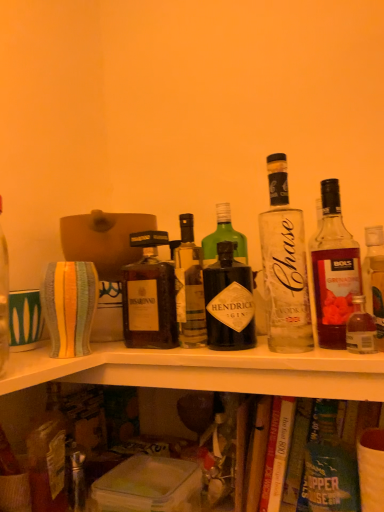
Question: Is translucent glass bottle at upper right, marked as the first bottle in a right-to-left arrangement, facing away from hardcover book at lower center?

Choices:
 (A) yes
 (B) no

Answer: (B)

Question: Does translucent glass bottle at upper right, the sixth bottle from the left, come behind hardcover book at lower center?

Choices:
 (A) yes
 (B) no

Answer: (B)

Question: Can you confirm if translucent glass bottle at upper right, the sixth bottle from the left, is wider than hardcover book at lower center?

Choices:
 (A) yes
 (B) no

Answer: (B)

Question: Would you say translucent glass bottle at upper right, the sixth bottle from the left, contains hardcover book at lower center?

Choices:
 (A) yes
 (B) no

Answer: (B)

Question: Does translucent glass bottle at upper right, marked as the first bottle in a right-to-left arrangement, appear on the left side of hardcover book at lower center?

Choices:
 (A) no
 (B) yes

Answer: (A)

Question: In the image, is translucent glass bottle at upper right, marked as the first bottle in a right-to-left arrangement, positioned in front of or behind hardcover book at lower center?

Choices:
 (A) front
 (B) behind

Answer: (A)

Question: From a real-world perspective, relative to hardcover book at lower center, is translucent glass bottle at upper right, marked as the first bottle in a right-to-left arrangement, vertically above or below?

Choices:
 (A) below
 (B) above

Answer: (B)

Question: From the image's perspective, is translucent glass bottle at upper right, marked as the first bottle in a right-to-left arrangement, located above or below hardcover book at lower center?

Choices:
 (A) below
 (B) above

Answer: (B)

Question: In terms of width, does translucent glass bottle at upper right, marked as the first bottle in a right-to-left arrangement, look wider or thinner when compared to hardcover book at lower center?

Choices:
 (A) wide
 (B) thin

Answer: (B)

Question: From a real-world perspective, is translucent glass bottle at upper right, marked as the first bottle in a right-to-left arrangement, above or below translucent glass bottle at upper right, positioned as the fifth bottle in left-to-right order?

Choices:
 (A) below
 (B) above

Answer: (A)

Question: From the image's perspective, is translucent glass bottle at upper right, the sixth bottle from the left, positioned above or below translucent glass bottle at upper right, positioned as the fifth bottle in left-to-right order?

Choices:
 (A) above
 (B) below

Answer: (B)

Question: Choose the correct answer: Is translucent glass bottle at upper right, the sixth bottle from the left, inside translucent glass bottle at upper right, positioned as the fifth bottle in left-to-right order, or outside it?

Choices:
 (A) inside
 (B) outside

Answer: (B)

Question: Is translucent glass bottle at upper right, marked as the first bottle in a right-to-left arrangement, in front of or behind translucent glass bottle at upper right, positioned as the fifth bottle in left-to-right order, in the image?

Choices:
 (A) front
 (B) behind

Answer: (A)

Question: In terms of size, does dark brown glass bottle at center, the fifth bottle in the right-to-left sequence, appear bigger or smaller than green glass bottle at center, the fourth bottle when ordered from left to right?

Choices:
 (A) big
 (B) small

Answer: (B)

Question: Choose the correct answer: Is dark brown glass bottle at center, which is the 2th bottle in left-to-right order, inside green glass bottle at center, the fourth bottle when ordered from left to right, or outside it?

Choices:
 (A) outside
 (B) inside

Answer: (A)